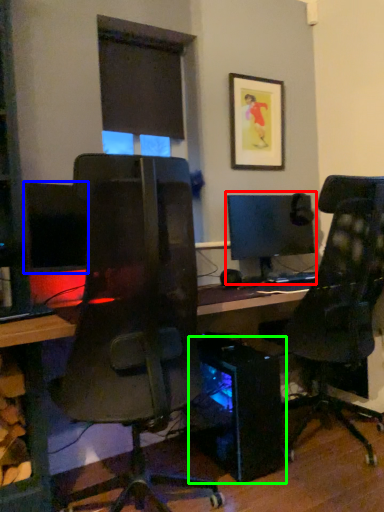
Question: Based on their relative distances, which object is farther from computer monitor (highlighted by a red box)? Choose from computer monitor (highlighted by a blue box) and computer tower (highlighted by a green box).

Choices:
 (A) computer monitor
 (B) computer tower

Answer: (A)